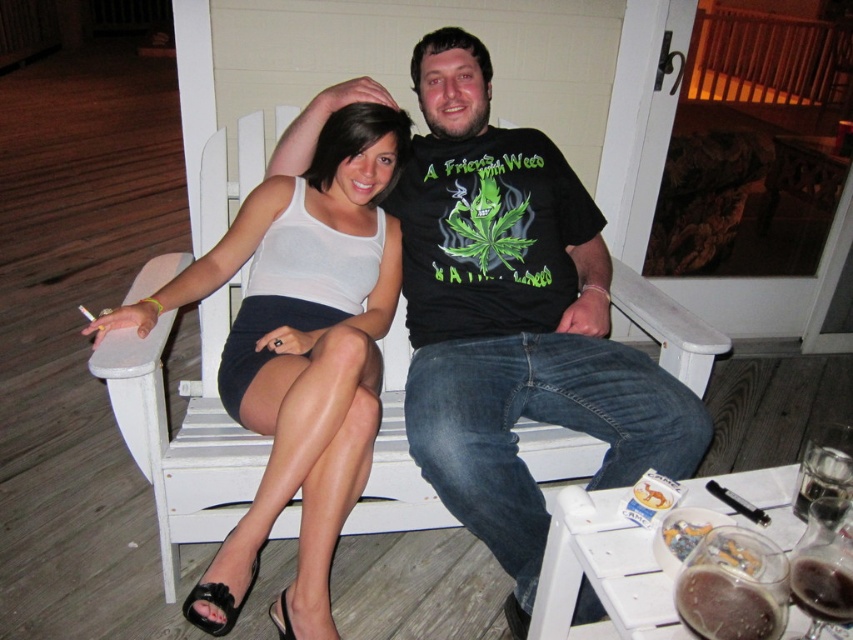
Question: Does black matte t-shirt at center have a larger size compared to white matte tank top at center?

Choices:
 (A) yes
 (B) no

Answer: (A)

Question: Does white matte tank top at center have a greater width compared to translucent glass beer at lower right?

Choices:
 (A) yes
 (B) no

Answer: (A)

Question: Among these points, which one is farthest from the camera?

Choices:
 (A) (613, 404)
 (B) (366, 340)
 (C) (846, 593)

Answer: (A)

Question: Can you confirm if black matte t-shirt at center is bigger than white matte tank top at center?

Choices:
 (A) no
 (B) yes

Answer: (B)

Question: Among these objects, which one is farthest from the camera?

Choices:
 (A) translucent glass beer at lower right
 (B) black matte t-shirt at center
 (C) white matte tank top at center

Answer: (B)

Question: Which of the following is the closest to the observer?

Choices:
 (A) click(x=250, y=282)
 (B) click(x=817, y=588)
 (C) click(x=440, y=355)

Answer: (B)